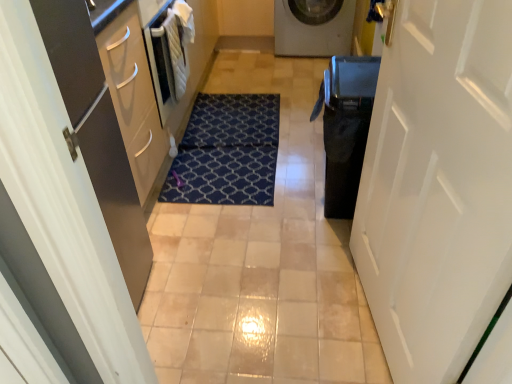
Question: Does black glossy dishwasher at right appear on the right side of white matte door at right, which ranks as the second door in left-to-right order?

Choices:
 (A) yes
 (B) no

Answer: (B)

Question: Is black glossy dishwasher at right directly adjacent to white matte door at right, the first door from the right?

Choices:
 (A) no
 (B) yes

Answer: (A)

Question: Considering the relative sizes of black glossy dishwasher at right and white matte door at right, the first door from the right, in the image provided, is black glossy dishwasher at right thinner than white matte door at right, the first door from the right,?

Choices:
 (A) yes
 (B) no

Answer: (B)

Question: From the image's perspective, is black glossy dishwasher at right on white matte door at right, the first door from the right?

Choices:
 (A) no
 (B) yes

Answer: (B)

Question: Is black glossy dishwasher at right positioned behind white matte door at right, which ranks as the second door in left-to-right order?

Choices:
 (A) yes
 (B) no

Answer: (A)

Question: From a real-world perspective, relative to blue patterned mat at center, is matte white door at left, placed as the second door when sorted from right to left, vertically above or below?

Choices:
 (A) below
 (B) above

Answer: (B)

Question: From the image's perspective, relative to blue patterned mat at center, is matte white door at left, placed as the second door when sorted from right to left, above or below?

Choices:
 (A) above
 (B) below

Answer: (A)

Question: Based on their sizes in the image, would you say matte white door at left, the first door in the left-to-right sequence, is bigger or smaller than blue patterned mat at center?

Choices:
 (A) big
 (B) small

Answer: (A)

Question: In the image, is matte white door at left, the first door in the left-to-right sequence, positioned in front of or behind blue patterned mat at center?

Choices:
 (A) behind
 (B) front

Answer: (B)

Question: Considering their positions, is gold metallic door handle at upper right located in front of or behind white matte door at right, which ranks as the second door in left-to-right order?

Choices:
 (A) front
 (B) behind

Answer: (B)

Question: From the image's perspective, relative to white matte door at right, which ranks as the second door in left-to-right order, is gold metallic door handle at upper right above or below?

Choices:
 (A) below
 (B) above

Answer: (B)

Question: From their relative heights in the image, would you say gold metallic door handle at upper right is taller or shorter than white matte door at right, the first door from the right?

Choices:
 (A) tall
 (B) short

Answer: (B)

Question: From a real-world perspective, is gold metallic door handle at upper right positioned above or below white matte door at right, which ranks as the second door in left-to-right order?

Choices:
 (A) above
 (B) below

Answer: (A)

Question: Looking at their shapes, would you say blue patterned mat at center is wider or thinner than black glossy dishwasher at right?

Choices:
 (A) thin
 (B) wide

Answer: (B)

Question: Is blue patterned mat at center taller or shorter than black glossy dishwasher at right?

Choices:
 (A) short
 (B) tall

Answer: (A)